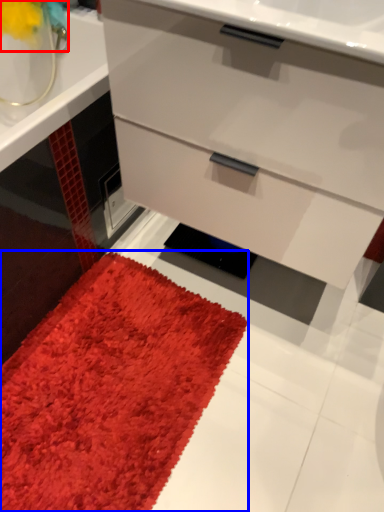
Question: Among these objects, which one is farthest to the camera, flower (highlighted by a red box) or mat (highlighted by a blue box)?

Choices:
 (A) flower
 (B) mat

Answer: (A)